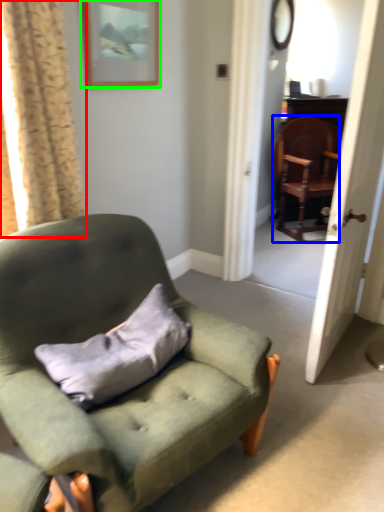
Question: Considering the real-world distances, which object is closest to curtain (highlighted by a red box)? chair (highlighted by a blue box) or picture frame (highlighted by a green box).

Choices:
 (A) chair
 (B) picture frame

Answer: (B)